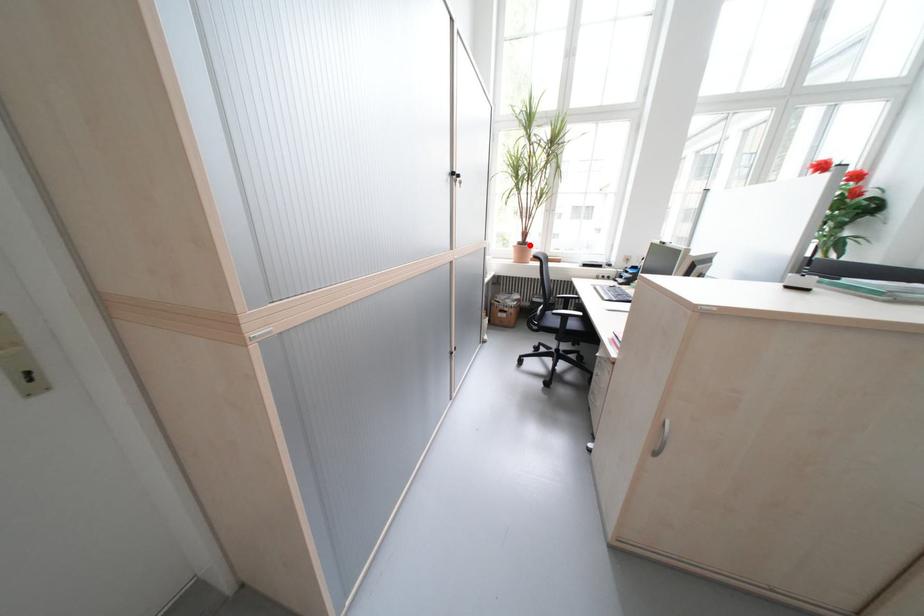
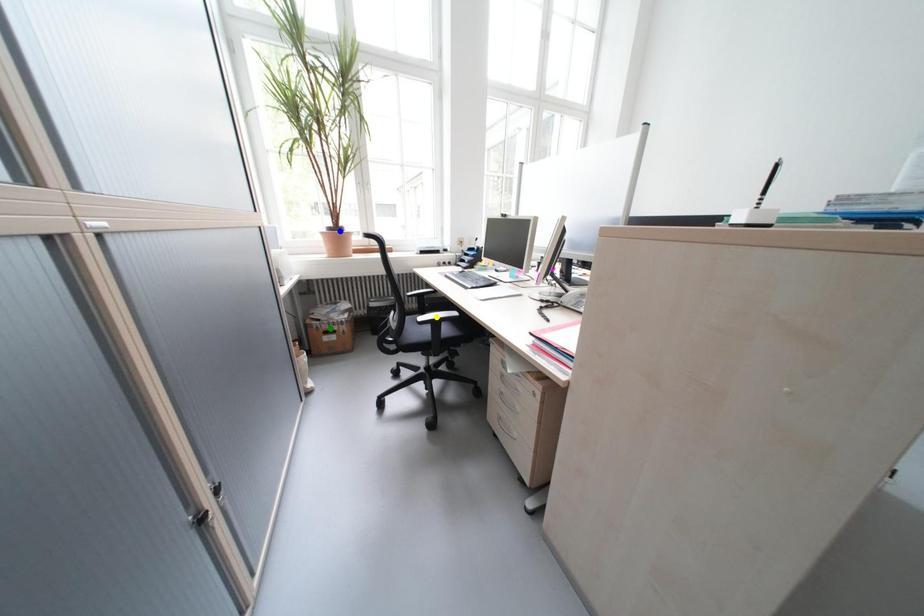
Question: I am providing you with two images of the same scene from different viewpoints. A red point is marked on the first image. You are given multiple points on the second image. Can you choose the point in image 2 that corresponds to the point in image 1?

Choices:
 (A) yellow point
 (B) blue point
 (C) green point

Answer: (B)